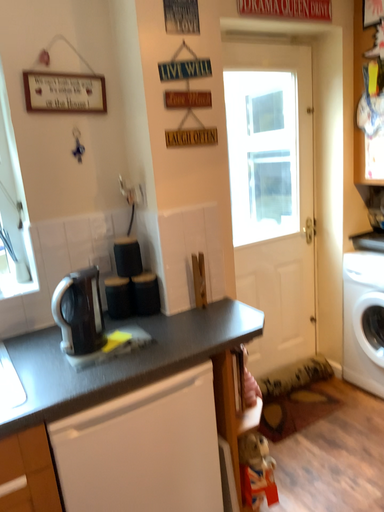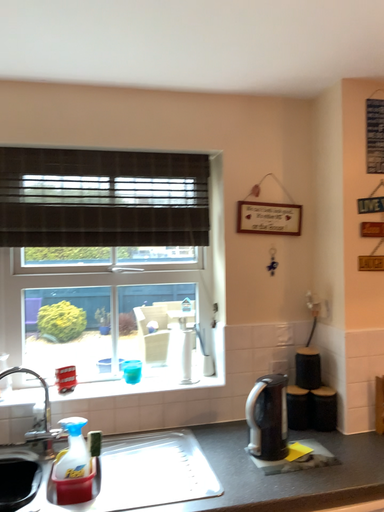
Question: Which way did the camera rotate in the video?

Choices:
 (A) rotated upward
 (B) rotated downward

Answer: (A)